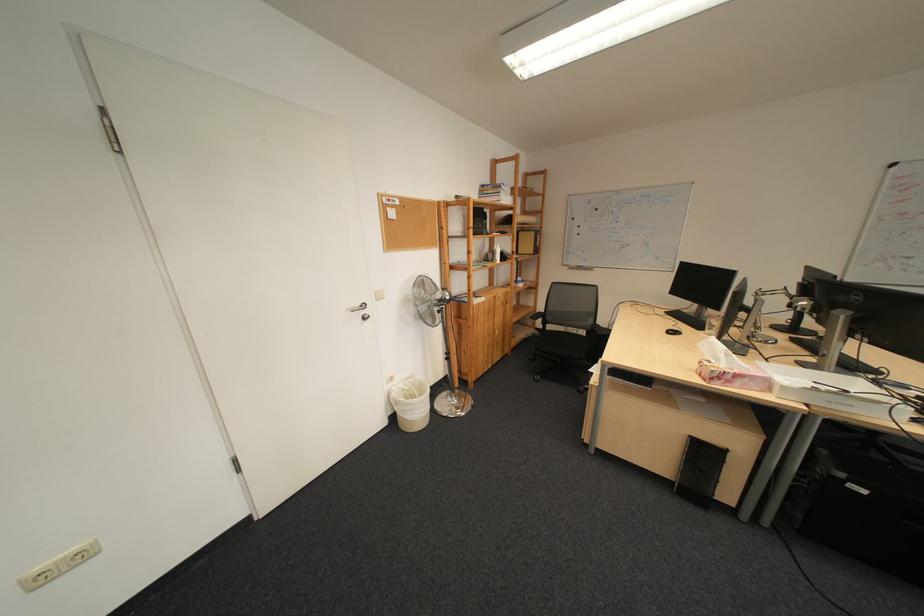
Locate an element on the screen. The width and height of the screenshot is (924, 616). chair sitting surface is located at coordinates (560, 346).